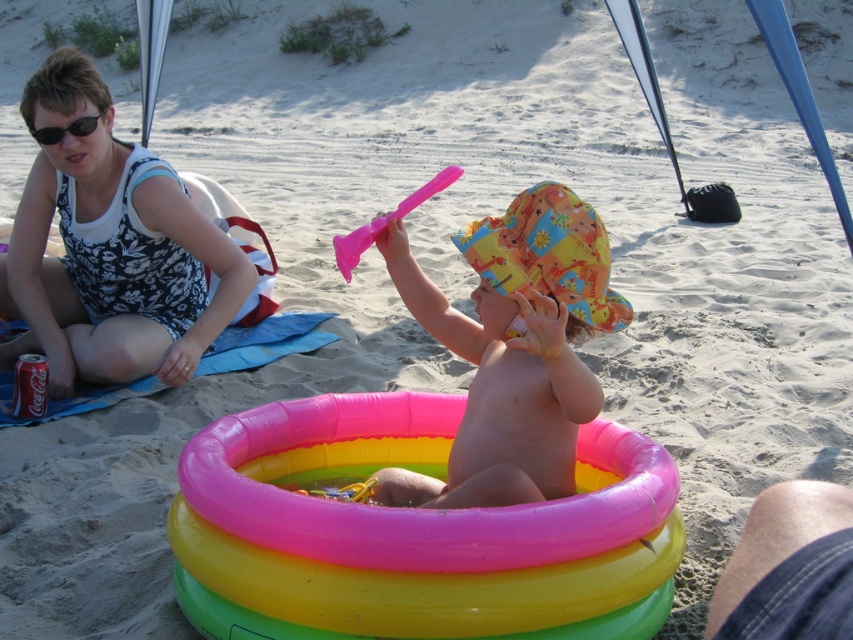
Is point (344, 557) less distant than point (100, 301)?

Yes, point (344, 557) is closer to viewer.

How far apart are rubber inflatable pool at center and printed fabric tank top at upper left?

rubber inflatable pool at center is 1.61 meters from printed fabric tank top at upper left.

Is point (440, 515) farther from camera compared to point (141, 230)?

No, (440, 515) is closer to viewer.

The image size is (853, 640). What are the coordinates of `rubber inflatable pool at center` in the screenshot? It's located at (413, 532).

Is pink plastic spoon at center above black plastic sunglasses at upper left?

No, pink plastic spoon at center is not above black plastic sunglasses at upper left.

Is pink plastic spoon at center below black plastic sunglasses at upper left?

Yes.

Locate an element on the screen. Image resolution: width=853 pixels, height=640 pixels. pink plastic spoon at center is located at coordinates (386, 221).

Locate an element on the screen. pink plastic spoon at center is located at coordinates (386, 221).

Between rubber inflatable pool at center and pink plastic spoon at center, which one is positioned higher?

pink plastic spoon at center is above.

Find the location of a particular element. This screenshot has height=640, width=853. rubber inflatable pool at center is located at coordinates (413, 532).

Identify the location of rubber inflatable pool at center. (413, 532).